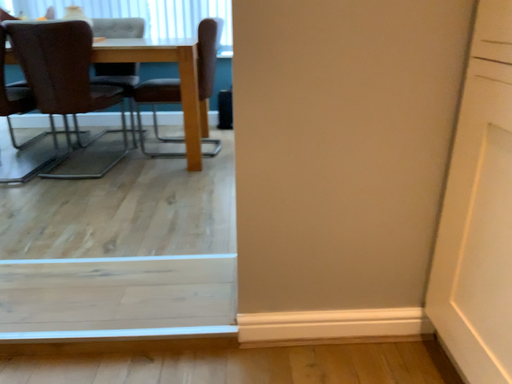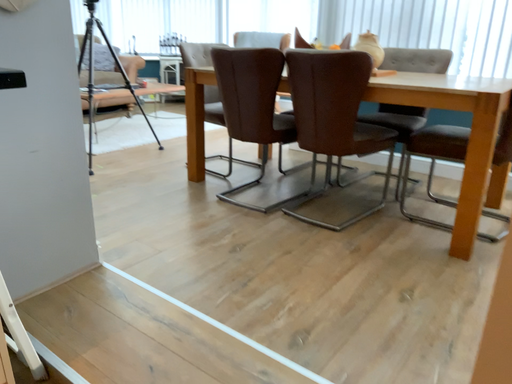
Question: How did the camera likely rotate when shooting the video?

Choices:
 (A) rotated downward
 (B) rotated upward

Answer: (B)